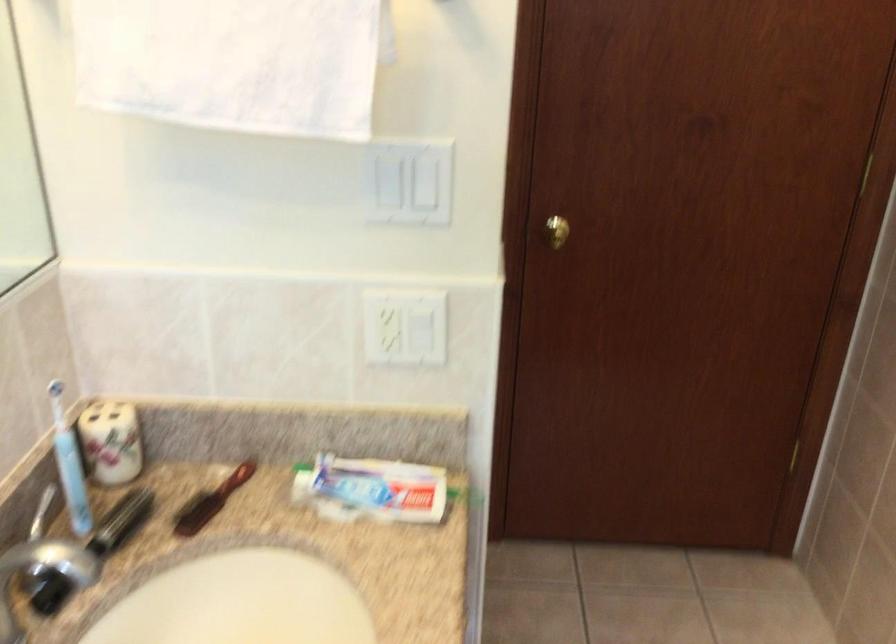
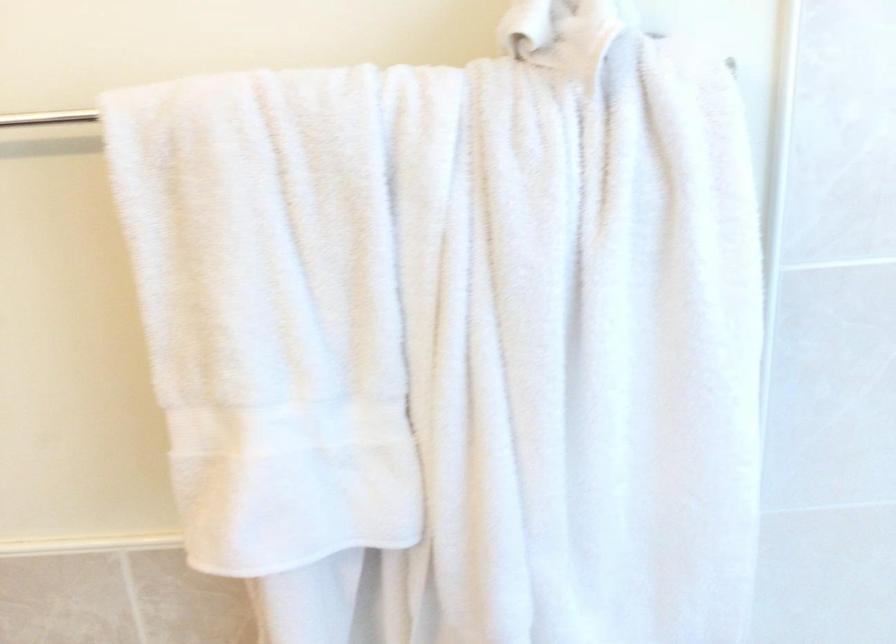
The images are taken continuously from a first-person perspective. In which direction is your viewpoint rotating?

→ The camera rotated toward right-down.